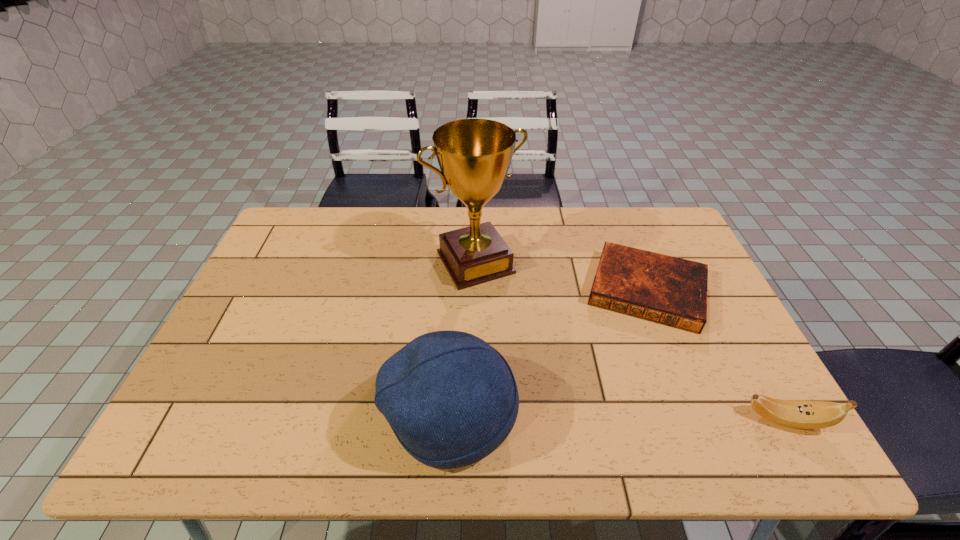
This screenshot has height=540, width=960. In order to click on the third shortest object in this screenshot , I will do `click(451, 399)`.

The width and height of the screenshot is (960, 540). Find the location of `banana`. banana is located at coordinates (798, 414).

Find the location of a particular element. Image resolution: width=960 pixels, height=540 pixels. the shortest object is located at coordinates (668, 290).

You are a GUI agent. You are given a task and a screenshot of the screen. Output one action in this format:
    pyautogui.click(x=<x>, y=<y>)
    Task: Click on the award
    Image resolution: width=960 pixels, height=540 pixels.
    Given the screenshot: What is the action you would take?
    point(474,155)

The image size is (960, 540). Identify the location of free space located 0.360m on the left of the skullcap. (228, 413).

Locate an element on the screen. This screenshot has height=540, width=960. vacant space situated on the back of the banana is located at coordinates (762, 376).

Image resolution: width=960 pixels, height=540 pixels. In order to click on free space located 0.250m on the spine side of the shortest object in this screenshot , I will do `click(624, 410)`.

You are a GUI agent. You are given a task and a screenshot of the screen. Output one action in this format:
    pyautogui.click(x=<x>, y=<y>)
    Task: Click on the vacant space located on the spine side of the shortest object
    
    Given the screenshot: What is the action you would take?
    pyautogui.click(x=628, y=392)

Image resolution: width=960 pixels, height=540 pixels. What are the coordinates of `free space located 0.160m on the spine side of the shortest object` in the screenshot? It's located at (630, 379).

The height and width of the screenshot is (540, 960). Find the location of `vacant position located on the plaque of the award`. vacant position located on the plaque of the award is located at coordinates (539, 360).